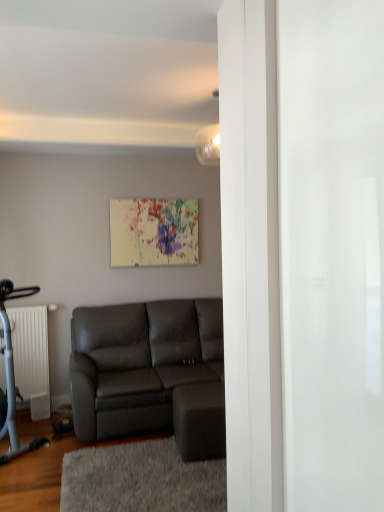
Question: Does gray textured rug at lower center turn towards matte white light fixture at upper center?

Choices:
 (A) yes
 (B) no

Answer: (B)

Question: Is gray textured rug at lower center behind matte white light fixture at upper center?

Choices:
 (A) no
 (B) yes

Answer: (A)

Question: Does gray textured rug at lower center have a larger size compared to matte white light fixture at upper center?

Choices:
 (A) no
 (B) yes

Answer: (B)

Question: From a real-world perspective, is gray textured rug at lower center below matte white light fixture at upper center?

Choices:
 (A) yes
 (B) no

Answer: (A)

Question: Considering the relative sizes of gray textured rug at lower center and matte white light fixture at upper center in the image provided, is gray textured rug at lower center smaller than matte white light fixture at upper center?

Choices:
 (A) yes
 (B) no

Answer: (B)

Question: Is matte gray couch at center inside the boundaries of matte white light fixture at upper center, or outside?

Choices:
 (A) inside
 (B) outside

Answer: (B)

Question: From a real-world perspective, is matte gray couch at center positioned above or below matte white light fixture at upper center?

Choices:
 (A) above
 (B) below

Answer: (B)

Question: Is point (137, 413) closer or farther from the camera than point (211, 93)?

Choices:
 (A) closer
 (B) farther

Answer: (B)

Question: From the image's perspective, is matte gray couch at center located above or below matte white light fixture at upper center?

Choices:
 (A) below
 (B) above

Answer: (A)

Question: Considering the positions of matte white light fixture at upper center and matte gray couch at center in the image, is matte white light fixture at upper center bigger or smaller than matte gray couch at center?

Choices:
 (A) small
 (B) big

Answer: (A)

Question: Is point (210, 157) closer or farther from the camera than point (162, 366)?

Choices:
 (A) closer
 (B) farther

Answer: (A)

Question: In the image, is matte white light fixture at upper center on the left side or the right side of matte gray couch at center?

Choices:
 (A) right
 (B) left

Answer: (A)

Question: Is matte white light fixture at upper center in front of or behind matte gray couch at center in the image?

Choices:
 (A) front
 (B) behind

Answer: (B)

Question: Considering the positions of white matte radiator at left and matte white light fixture at upper center in the image, is white matte radiator at left taller or shorter than matte white light fixture at upper center?

Choices:
 (A) short
 (B) tall

Answer: (B)

Question: Visually, is white matte radiator at left positioned to the left or to the right of matte white light fixture at upper center?

Choices:
 (A) right
 (B) left

Answer: (B)